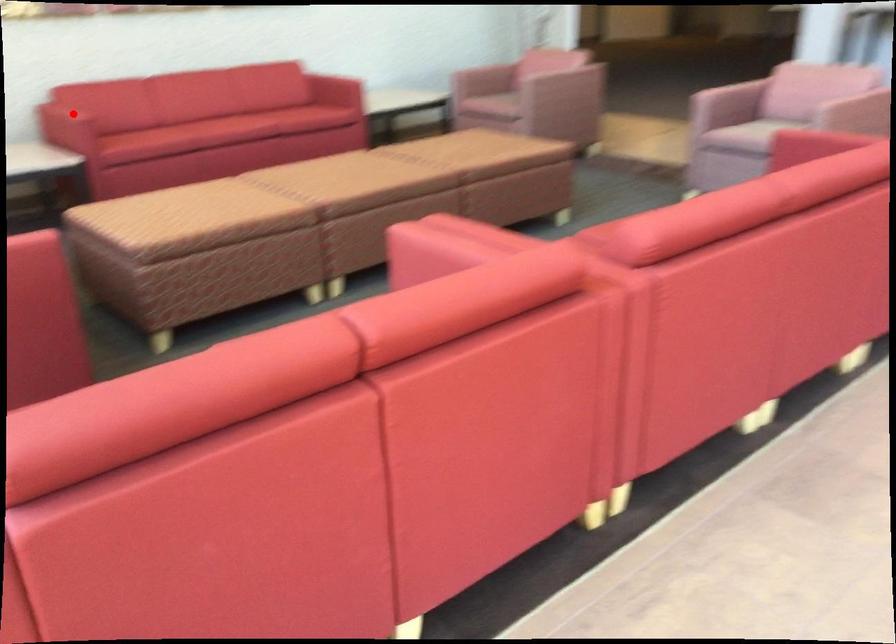
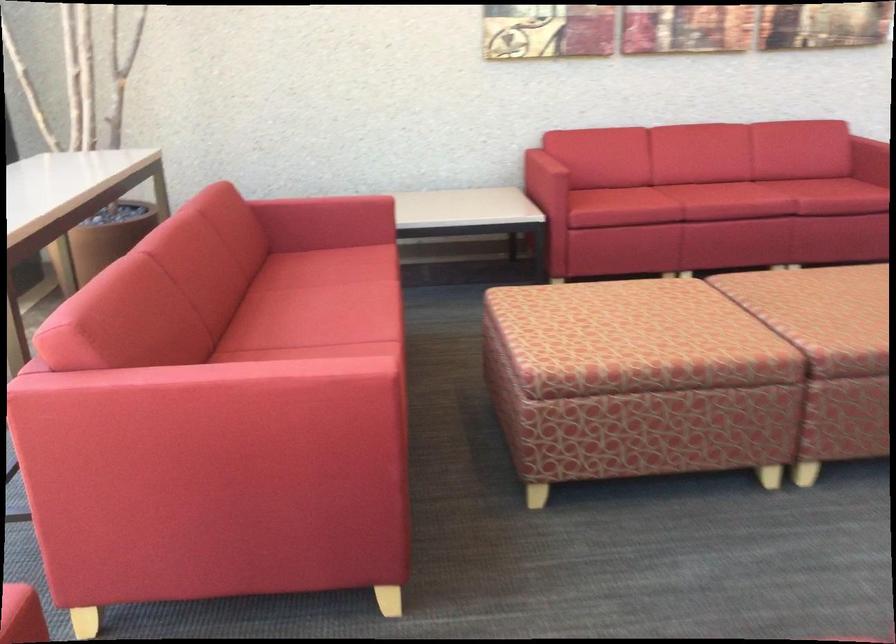
The point at the highlighted location is marked in the first image. Where is the corresponding point in the second image?

(545, 166)